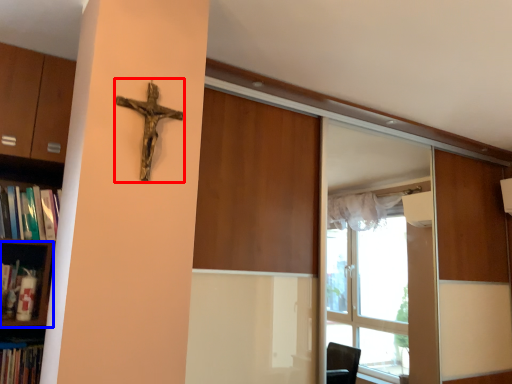
Question: Which object appears farthest to the camera in this image, crucifix (highlighted by a red box) or shelf (highlighted by a blue box)?

Choices:
 (A) crucifix
 (B) shelf

Answer: (B)